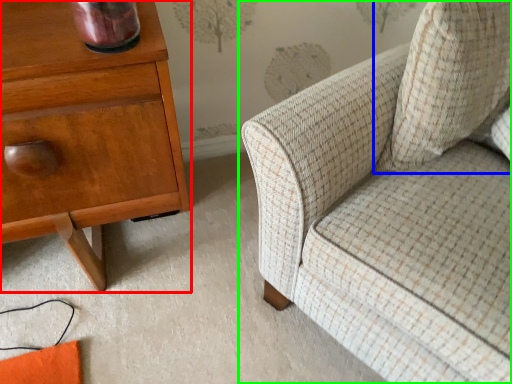
Question: Estimate the real-world distances between objects in this image. Which object is closer to nightstand (highlighted by a red box), throw pillow (highlighted by a blue box) or chair (highlighted by a green box)?

Choices:
 (A) throw pillow
 (B) chair

Answer: (B)